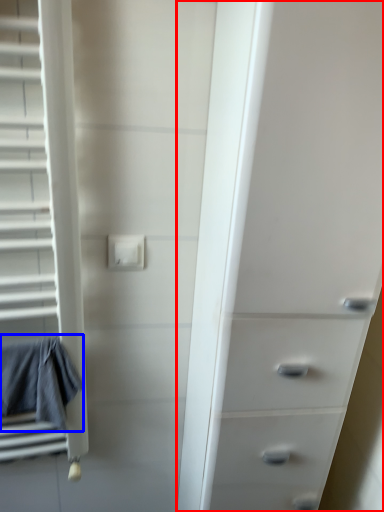
Question: Which object is closer to the camera taking this photo, chest of drawers (highlighted by a red box) or bath towel (highlighted by a blue box)?

Choices:
 (A) chest of drawers
 (B) bath towel

Answer: (A)